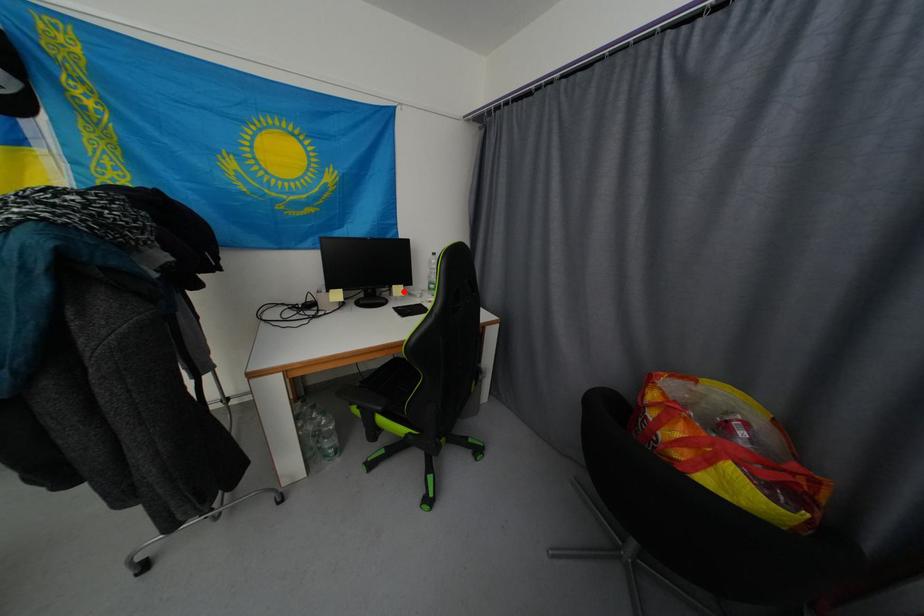
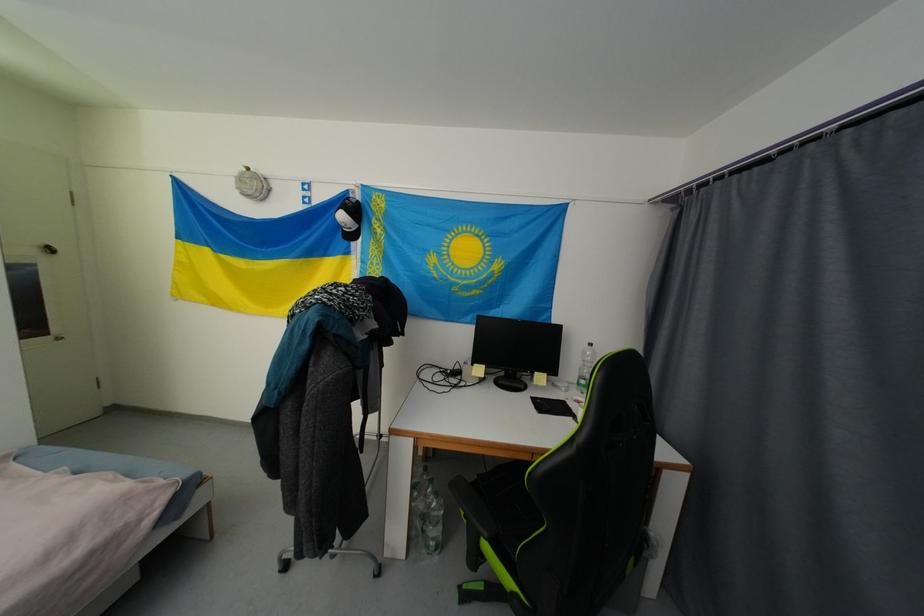
Locate, in the second image, the point that corresponds to the highlighted location in the first image.

(545, 379)